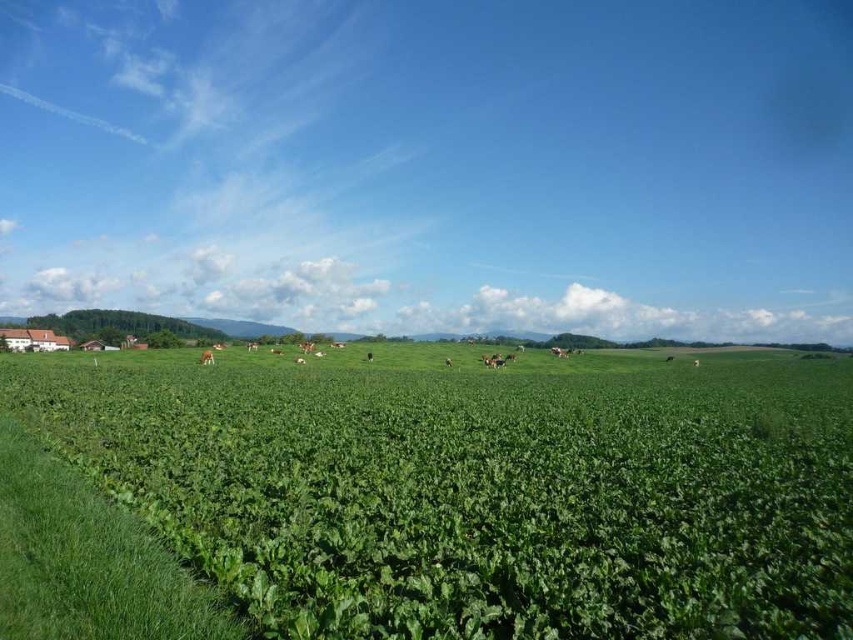
Measure the distance from green leafy field at center to brown furry cow at center.

green leafy field at center and brown furry cow at center are 163.18 meters apart from each other.

Identify the location of green leafy field at center. (480, 490).

Where is `green leafy field at center`? green leafy field at center is located at coordinates (480, 490).